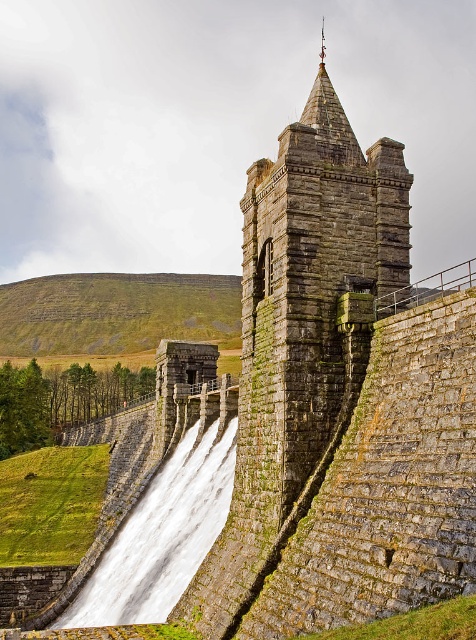
Question: In this image, where is rusty stone tower at upper center located relative to white stone waterfall at lower left?

Choices:
 (A) below
 (B) above

Answer: (B)

Question: Which of the following is the closest to the observer?

Choices:
 (A) (333, 364)
 (B) (204, 538)

Answer: (A)

Question: In this image, where is rusty stone tower at upper center located relative to white stone waterfall at lower left?

Choices:
 (A) above
 (B) below

Answer: (A)

Question: Is rusty stone tower at upper center below white stone waterfall at lower left?

Choices:
 (A) yes
 (B) no

Answer: (B)

Question: Among these points, which one is nearest to the camera?

Choices:
 (A) (307, 301)
 (B) (234, 428)

Answer: (A)